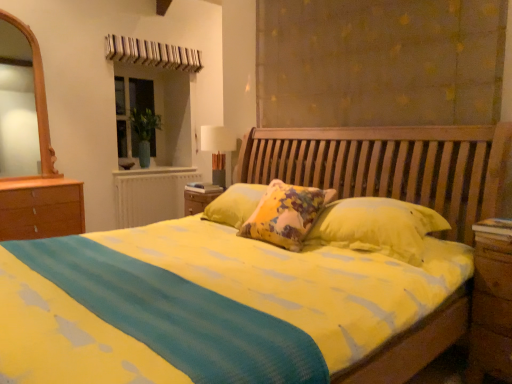
Question: Is point (208, 135) positioned closer to the camera than point (493, 231)?

Choices:
 (A) closer
 (B) farther

Answer: (B)

Question: Is white fabric lampshade at upper center taller or shorter than brown wooden nightstand at right?

Choices:
 (A) tall
 (B) short

Answer: (B)

Question: Estimate the real-world distances between objects in this image. Which object is farther from the matte brown curtain at upper center?

Choices:
 (A) brown wooden nightstand at right
 (B) white painted radiator at center
 (C) green glass vase at upper left
 (D) white fabric lampshade at upper center

Answer: (C)

Question: Which object is positioned closest to the matte brown curtain at upper center?

Choices:
 (A) green glass vase at upper left
 (B) white painted radiator at center
 (C) white fabric lampshade at upper center
 (D) brown wooden nightstand at right

Answer: (C)